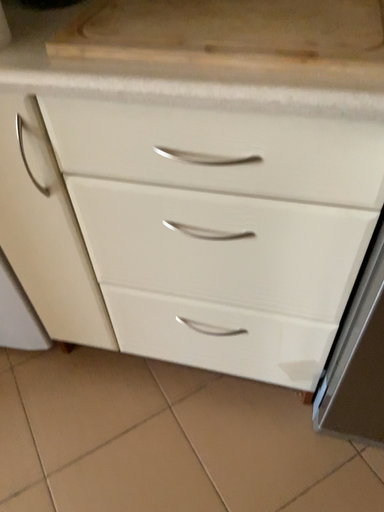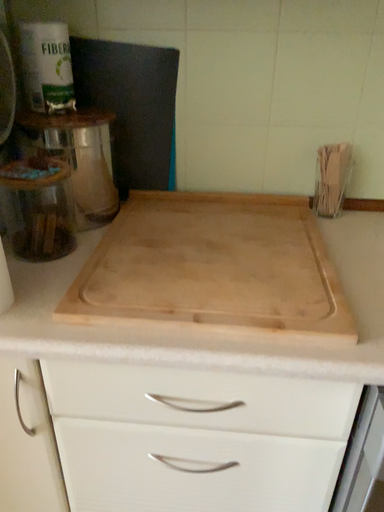
Question: Which way did the camera rotate in the video?

Choices:
 (A) rotated upward
 (B) rotated downward

Answer: (A)